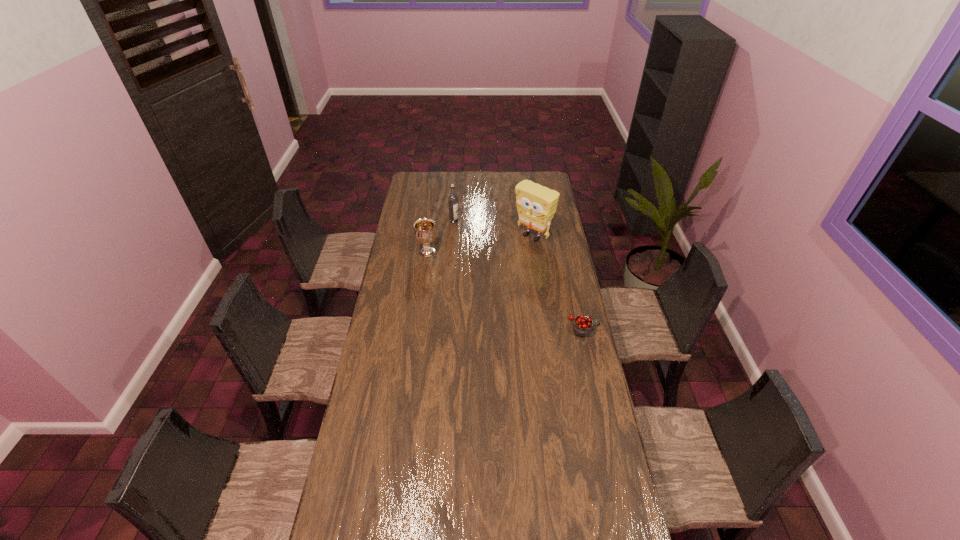
At what (x,y) coordinates should I click in order to perform the action: click on vacant space on the desktop that is between the third tallest object and the shortest object and is positioned on the label of the vodka. Please return your answer as a coordinate pair (x, y). Looking at the image, I should click on tap(487, 281).

This screenshot has width=960, height=540. In order to click on vacant spot on the desktop that is between the chalice and the pot filled with cherries and is positioned on the face of the sponge in this screenshot , I will do click(482, 279).